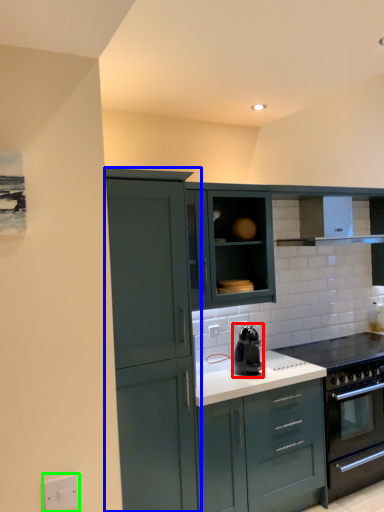
Question: Which is farther away from kitchen appliance (highlighted by a red box)? cabinetry (highlighted by a blue box) or electric outlet (highlighted by a green box)?

Choices:
 (A) cabinetry
 (B) electric outlet

Answer: (B)